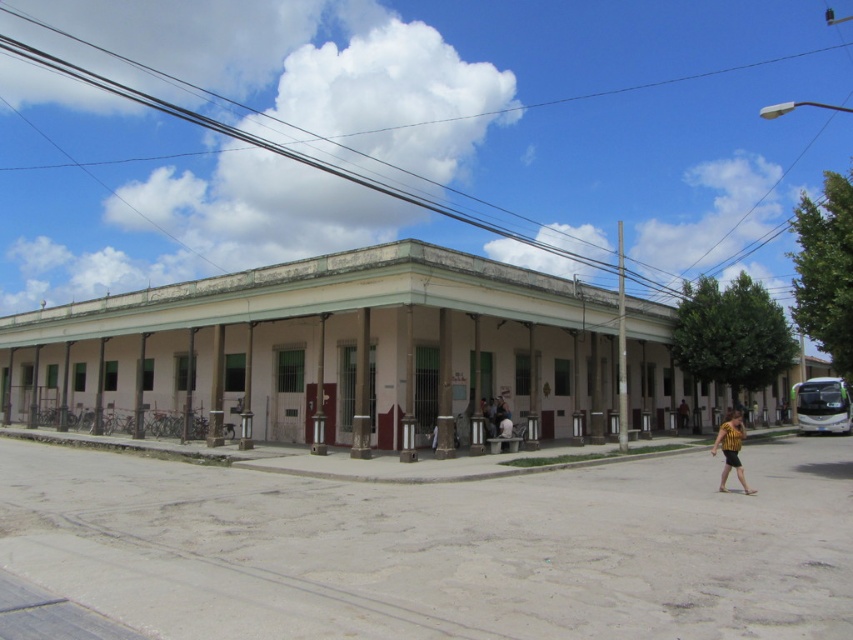
Which is above, yellow striped shirt at lower right or brown leather jacket at lower right?

yellow striped shirt at lower right

Is point (737, 477) behind point (677, 410)?

No, (737, 477) is in front of (677, 410).

Identify the location of yellow striped shirt at lower right. (730, 449).